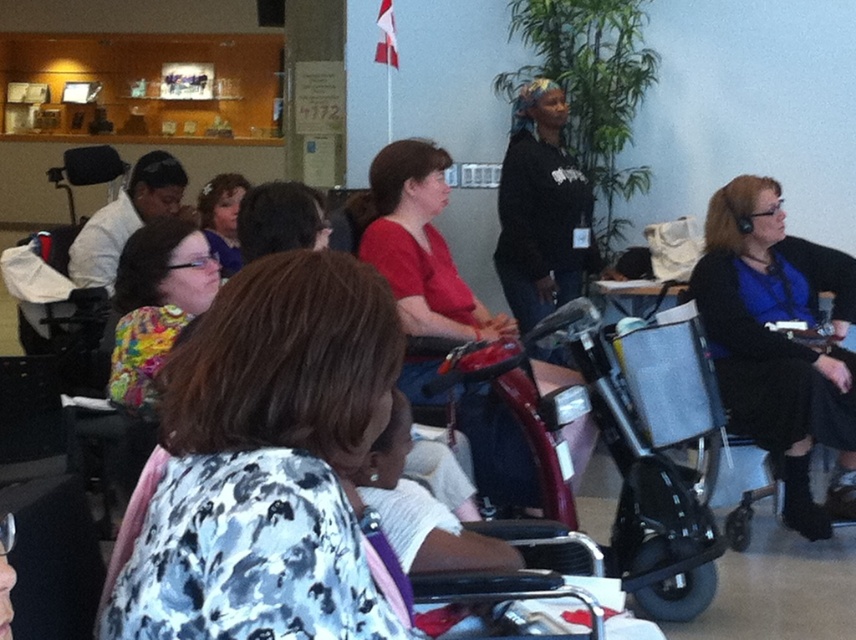
Who is positioned more to the right, floral-patterned blouse at center or metallic red mobility scooter at center?

metallic red mobility scooter at center is more to the right.

Who is higher up, floral-patterned blouse at center or metallic red mobility scooter at center?

floral-patterned blouse at center is above.

Locate an element on the screen. floral-patterned blouse at center is located at coordinates (266, 461).

Can you confirm if matte black wheelchair at right is wider than floral fabric shirt at left?

Yes.

Is the position of matte black wheelchair at right more distant than that of floral fabric shirt at left?

Yes, it is behind floral fabric shirt at left.

Measure the distance between matte black wheelchair at right and camera.

The distance of matte black wheelchair at right from camera is 3.53 meters.

Locate an element on the screen. The width and height of the screenshot is (856, 640). matte black wheelchair at right is located at coordinates (779, 342).

Between matte black wheelchair at right and matte floral blouse at center, which one has more height?

Standing taller between the two is matte black wheelchair at right.

Between matte black wheelchair at right and matte floral blouse at center, which one has less height?

Standing shorter between the two is matte floral blouse at center.

What do you see at coordinates (779, 342) in the screenshot? I see `matte black wheelchair at right` at bounding box center [779, 342].

You are a GUI agent. You are given a task and a screenshot of the screen. Output one action in this format:
    pyautogui.click(x=<x>, y=<y>)
    Task: Click on the matte black wheelchair at right
    The height and width of the screenshot is (640, 856).
    Given the screenshot: What is the action you would take?
    pyautogui.click(x=779, y=342)